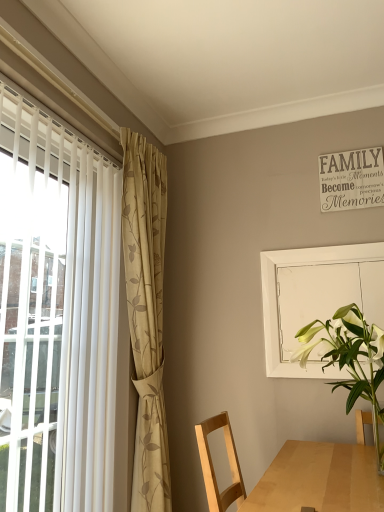
Question: From the image's perspective, is white glossy vase at lower right on top of beige floral fabric curtain at left?

Choices:
 (A) yes
 (B) no

Answer: (B)

Question: Considering the relative sizes of white glossy vase at lower right and beige floral fabric curtain at left in the image provided, is white glossy vase at lower right bigger than beige floral fabric curtain at left?

Choices:
 (A) no
 (B) yes

Answer: (A)

Question: Is white glossy vase at lower right shorter than beige floral fabric curtain at left?

Choices:
 (A) yes
 (B) no

Answer: (A)

Question: From a real-world perspective, is white glossy vase at lower right positioned over beige floral fabric curtain at left based on gravity?

Choices:
 (A) yes
 (B) no

Answer: (B)

Question: From a real-world perspective, is white glossy vase at lower right below beige floral fabric curtain at left?

Choices:
 (A) no
 (B) yes

Answer: (B)

Question: From the image's perspective, is white matte screen door at upper right located above or below beige floral fabric curtain at left?

Choices:
 (A) below
 (B) above

Answer: (B)

Question: Is white matte screen door at upper right in front of or behind beige floral fabric curtain at left in the image?

Choices:
 (A) behind
 (B) front

Answer: (A)

Question: Is white matte screen door at upper right to the left or to the right of beige floral fabric curtain at left in the image?

Choices:
 (A) right
 (B) left

Answer: (A)

Question: Does point (291, 308) appear closer or farther from the camera than point (160, 478)?

Choices:
 (A) closer
 (B) farther

Answer: (B)

Question: Is white glossy vase at lower right taller or shorter than white matte screen door at upper right?

Choices:
 (A) short
 (B) tall

Answer: (A)

Question: Is white glossy vase at lower right situated inside white matte screen door at upper right or outside?

Choices:
 (A) outside
 (B) inside

Answer: (A)

Question: In terms of width, does white glossy vase at lower right look wider or thinner when compared to white matte screen door at upper right?

Choices:
 (A) thin
 (B) wide

Answer: (B)

Question: Considering the positions of white glossy vase at lower right and white matte screen door at upper right in the image, is white glossy vase at lower right bigger or smaller than white matte screen door at upper right?

Choices:
 (A) small
 (B) big

Answer: (B)

Question: Is beige floral fabric curtain at left wider or thinner than white glossy vase at lower right?

Choices:
 (A) wide
 (B) thin

Answer: (B)

Question: Is beige floral fabric curtain at left inside or outside of white glossy vase at lower right?

Choices:
 (A) outside
 (B) inside

Answer: (A)